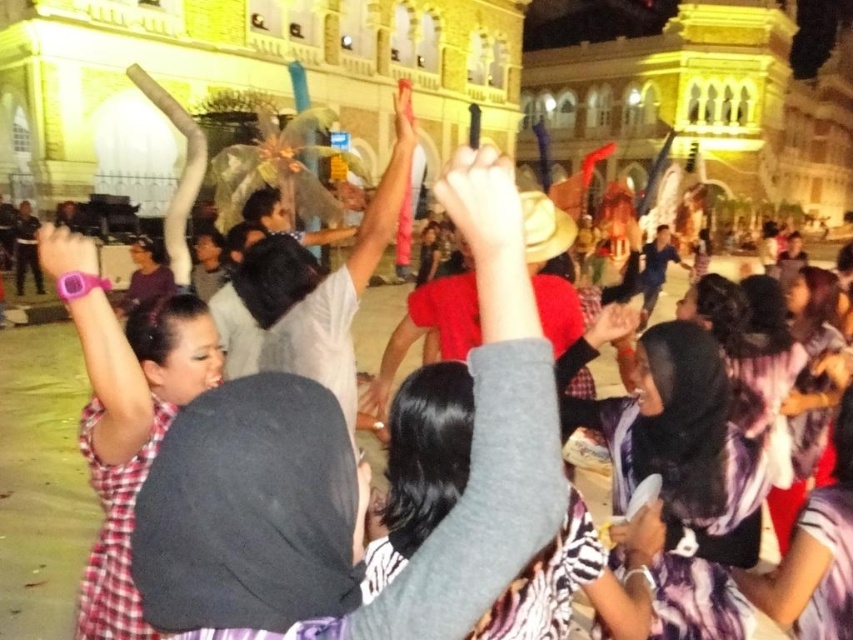
Based on the photo, is matte black hand at upper center bigger than pink matte hand at upper center?

Incorrect, matte black hand at upper center is not larger than pink matte hand at upper center.

Can you confirm if matte black hand at upper center is shorter than pink matte hand at upper center?

Yes, matte black hand at upper center is shorter than pink matte hand at upper center.

Between point (465, 157) and point (410, 132), which one is positioned behind?

Point (410, 132)

Locate an element on the screen. The width and height of the screenshot is (853, 640). matte black hand at upper center is located at coordinates (483, 205).

This screenshot has width=853, height=640. What do you see at coordinates (640, 534) in the screenshot?
I see `smooth yellow fabric at upper center` at bounding box center [640, 534].

Where is `smooth yellow fabric at upper center`? The image size is (853, 640). smooth yellow fabric at upper center is located at coordinates (640, 534).

This screenshot has width=853, height=640. What are the coordinates of `smooth yellow fabric at upper center` in the screenshot? It's located at (640, 534).

Does plaid fabric shirt at left have a larger size compared to smooth yellow fabric at upper center?

Indeed, plaid fabric shirt at left has a larger size compared to smooth yellow fabric at upper center.

Does point (96, 445) come farther from viewer compared to point (634, 538)?

No, it is in front of (634, 538).

Measure the distance between plaid fabric shirt at left and camera.

A distance of 112.81 feet exists between plaid fabric shirt at left and camera.

Locate an element on the screen. This screenshot has height=640, width=853. plaid fabric shirt at left is located at coordinates (131, 426).